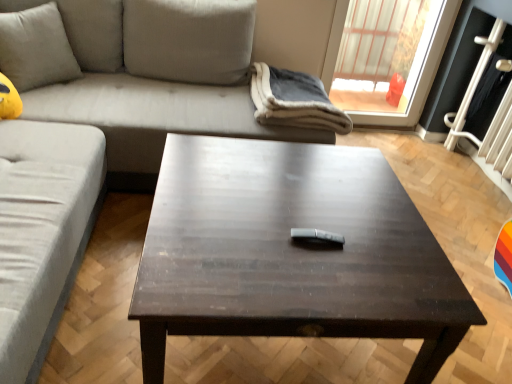
The image size is (512, 384). I want to click on light gray fabric couch at upper left, the second studio couch positioned from the front, so click(x=138, y=71).

Measure the distance between point (35, 35) and camera.

6.80 feet.

In order to face soft beige cushion at upper left, should I rotate leftwards or rightwards?

You should rotate left by 27.301 degrees.

This screenshot has width=512, height=384. Find the location of `suede gray couch at upper left, which ranks as the 1th studio couch in front-to-back order`. suede gray couch at upper left, which ranks as the 1th studio couch in front-to-back order is located at coordinates (160, 70).

What are the coordinates of `dark wood/black table at center` in the screenshot? It's located at (291, 252).

Based on the photo, from the image's perspective, which one is positioned lower, satin silver remote at center or soft gray fleece blanket at upper center?

satin silver remote at center, from the image's perspective.

From a real-world perspective, which object rests below the other?

From a 3D spatial view, soft gray fleece blanket at upper center is below.

Considering the relative sizes of satin silver remote at center and soft gray fleece blanket at upper center in the image provided, is satin silver remote at center wider than soft gray fleece blanket at upper center?

No.

Is satin silver remote at center shorter than soft gray fleece blanket at upper center?

Yes.

Considering the sizes of objects satin silver remote at center and dark wood/black table at center in the image provided, who is thinner, satin silver remote at center or dark wood/black table at center?

Thinner between the two is satin silver remote at center.

Is satin silver remote at center directly adjacent to dark wood/black table at center?

No, satin silver remote at center is not beside dark wood/black table at center.

Locate an element on the screen. coffee table lying in front of the satin silver remote at center is located at coordinates (291, 252).

From the picture: Is soft beige cushion at upper left not close to black glass screen door at upper right?

Yes, soft beige cushion at upper left and black glass screen door at upper right are located far from each other.

Consider the image. Is soft beige cushion at upper left wider than black glass screen door at upper right?

Indeed, soft beige cushion at upper left has a greater width compared to black glass screen door at upper right.

Is soft beige cushion at upper left to the left of black glass screen door at upper right from the viewer's perspective?

Yes.

From the image's perspective, is soft beige cushion at upper left on transparent plastic window at upper right?

Incorrect, from the image's perspective, soft beige cushion at upper left is lower than transparent plastic window at upper right.

Is point (4, 26) in front of point (328, 45)?

Yes.

Considering the sizes of soft beige cushion at upper left and transparent plastic window at upper right in the image, is soft beige cushion at upper left bigger or smaller than transparent plastic window at upper right?

soft beige cushion at upper left is bigger than transparent plastic window at upper right.

Is soft beige cushion at upper left positioned beyond the bounds of transparent plastic window at upper right?

soft beige cushion at upper left is positioned outside transparent plastic window at upper right.

Is black glass screen door at upper right turned away from light gray fabric couch at upper left, the second studio couch positioned from the front?

black glass screen door at upper right does not have its back to light gray fabric couch at upper left, the second studio couch positioned from the front.

In the scene shown: From the image's perspective, is black glass screen door at upper right under light gray fabric couch at upper left, which appears as the 1th studio couch when viewed from the back?

Incorrect, from the image's perspective, black glass screen door at upper right is higher than light gray fabric couch at upper left, which appears as the 1th studio couch when viewed from the back.

From a real-world perspective, is black glass screen door at upper right over light gray fabric couch at upper left, the second studio couch positioned from the front?

Incorrect, from a real-world perspective, black glass screen door at upper right is lower than light gray fabric couch at upper left, the second studio couch positioned from the front.

Is black glass screen door at upper right further to camera compared to light gray fabric couch at upper left, the second studio couch positioned from the front?

That is True.

In the scene shown: Does soft beige cushion at upper left turn towards suede gray couch at upper left, which ranks as the 1th studio couch in front-to-back order?

Yes, soft beige cushion at upper left is facing suede gray couch at upper left, which ranks as the 1th studio couch in front-to-back order.

Does point (45, 74) come closer to viewer compared to point (149, 140)?

No, it is not.

Are soft beige cushion at upper left and suede gray couch at upper left, acting as the 2th studio couch starting from the back, far apart?

No, soft beige cushion at upper left is not far away from suede gray couch at upper left, acting as the 2th studio couch starting from the back.

Is black glass screen door at upper right bigger than dark wood/black table at center?

Incorrect, black glass screen door at upper right is not larger than dark wood/black table at center.

Locate an element on the screen. The image size is (512, 384). coffee table lying below the black glass screen door at upper right (from the image's perspective) is located at coordinates (291, 252).

Could you tell me if black glass screen door at upper right is facing dark wood/black table at center?

No, black glass screen door at upper right is not facing towards dark wood/black table at center.

Identify the location of blanket located on the right of satin silver remote at center. Image resolution: width=512 pixels, height=384 pixels. (294, 100).

At what (x,y) coordinates should I click in order to perform the action: click on coffee table on the left side of satin silver remote at center. Please return your answer as a coordinate pair (x, y). Looking at the image, I should click on (291, 252).

From the image, which object appears to be farther from dark wood/black table at center, transparent plastic window at upper right or soft beige cushion at upper left?

transparent plastic window at upper right is positioned further to the anchor dark wood/black table at center.

From the picture: Looking at the image, which one is located further to soft beige cushion at upper left, satin silver remote at center or soft gray fleece blanket at upper center?

satin silver remote at center is positioned further to the anchor soft beige cushion at upper left.

From the image, which object appears to be farther from transparent plastic window at upper right, dark wood/black table at center or light gray fabric couch at upper left, the second studio couch positioned from the front?

Among the two, dark wood/black table at center is located further to transparent plastic window at upper right.

Looking at the image, which one is located further to transparent plastic window at upper right, black glass screen door at upper right or light gray fabric couch at upper left, which appears as the 1th studio couch when viewed from the back?

light gray fabric couch at upper left, which appears as the 1th studio couch when viewed from the back, is positioned further to the anchor transparent plastic window at upper right.

Estimate the real-world distances between objects in this image. Which object is closer to transparent plastic window at upper right, soft gray fleece blanket at upper center or suede gray couch at upper left, acting as the 2th studio couch starting from the back?

soft gray fleece blanket at upper center.

Estimate the real-world distances between objects in this image. Which object is further from soft beige cushion at upper left, black glass screen door at upper right or transparent plastic window at upper right?

Among the two, black glass screen door at upper right is located further to soft beige cushion at upper left.

Based on their spatial positions, is suede gray couch at upper left, acting as the 2th studio couch starting from the back, or transparent plastic window at upper right further from black glass screen door at upper right?

suede gray couch at upper left, acting as the 2th studio couch starting from the back, is further to black glass screen door at upper right.

From the image, which object appears to be nearer to suede gray couch at upper left, acting as the 2th studio couch starting from the back, dark wood/black table at center or transparent plastic window at upper right?

dark wood/black table at center is closer to suede gray couch at upper left, acting as the 2th studio couch starting from the back.

The image size is (512, 384). I want to click on blanket located between suede gray couch at upper left, acting as the 2th studio couch starting from the back, and transparent plastic window at upper right in the depth direction, so tap(294, 100).

Find the location of `coffee table located between suede gray couch at upper left, which ranks as the 1th studio couch in front-to-back order, and black glass screen door at upper right in the left-right direction`. coffee table located between suede gray couch at upper left, which ranks as the 1th studio couch in front-to-back order, and black glass screen door at upper right in the left-right direction is located at coordinates (291, 252).

Identify the location of remote located between suede gray couch at upper left, which ranks as the 1th studio couch in front-to-back order, and light gray fabric couch at upper left, the second studio couch positioned from the front, in the depth direction. (317, 235).

Find the location of a particular element. The height and width of the screenshot is (384, 512). coffee table situated between soft beige cushion at upper left and satin silver remote at center from left to right is located at coordinates (291, 252).